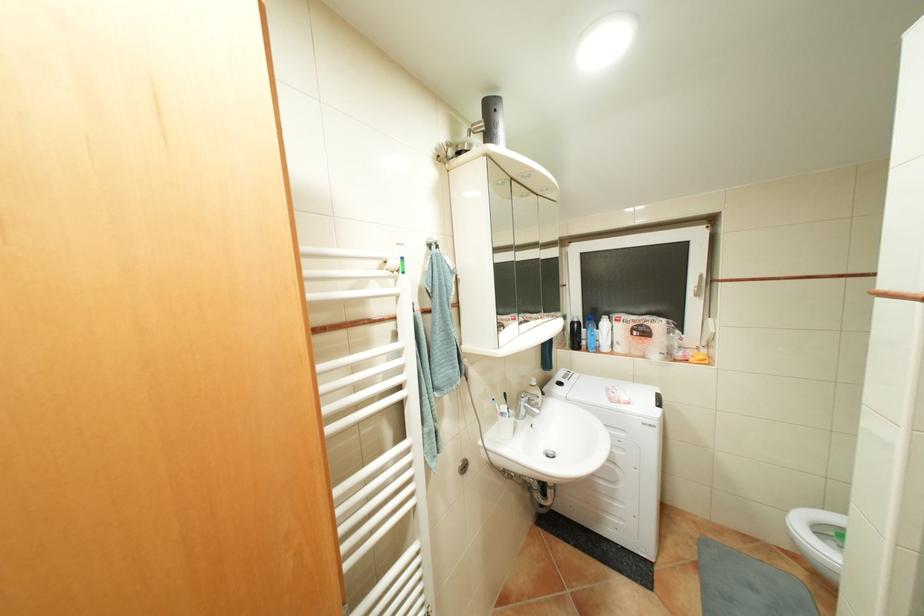
Where would you lift the washing machine lid? Please return your answer as a coordinate pair (x, y).

(562, 383)